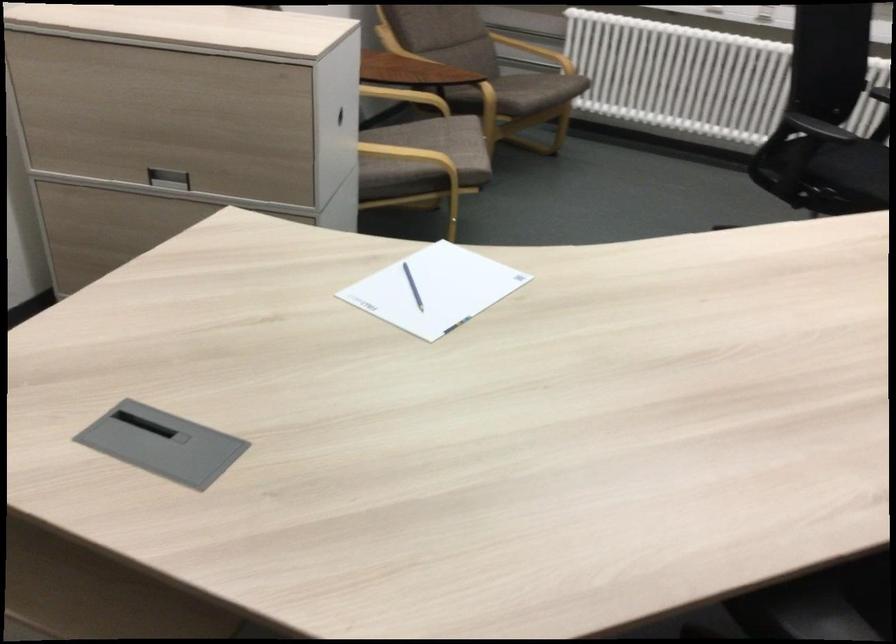
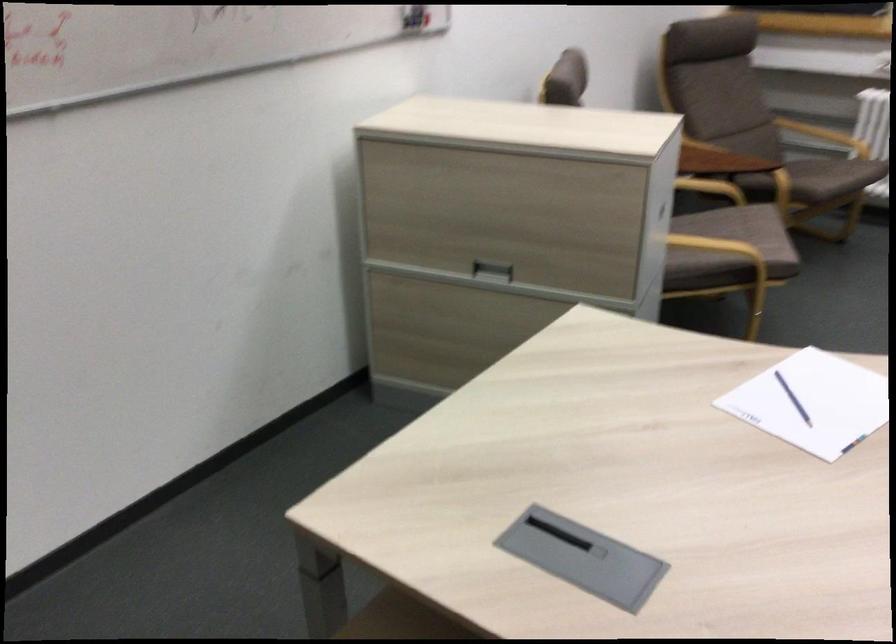
The point at (412, 285) is marked in the first image. Where is the corresponding point in the second image?

(793, 399)